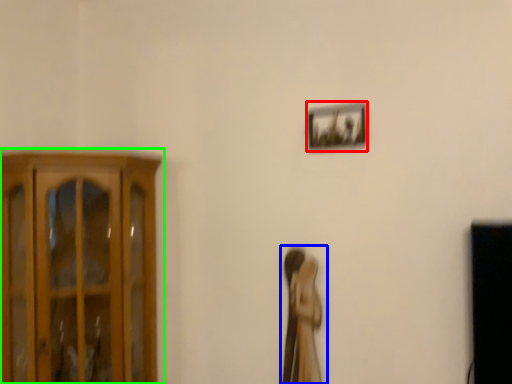
Question: Based on their relative distances, which object is farther from picture frame (highlighted by a red box)? Choose from woman (highlighted by a blue box) and cupboard (highlighted by a green box).

Choices:
 (A) woman
 (B) cupboard

Answer: (B)